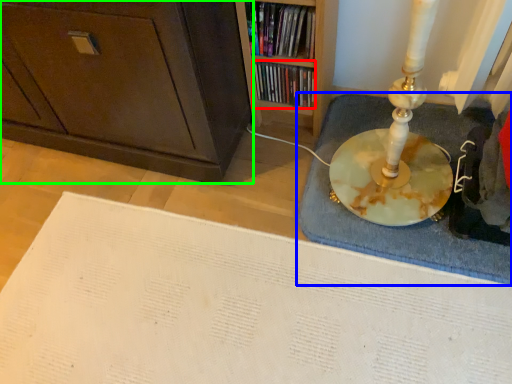
Question: Estimate the real-world distances between objects in this image. Which object is closer to book (highlighted by a red box), bath mat (highlighted by a blue box) or cabinetry (highlighted by a green box)?

Choices:
 (A) bath mat
 (B) cabinetry

Answer: (A)